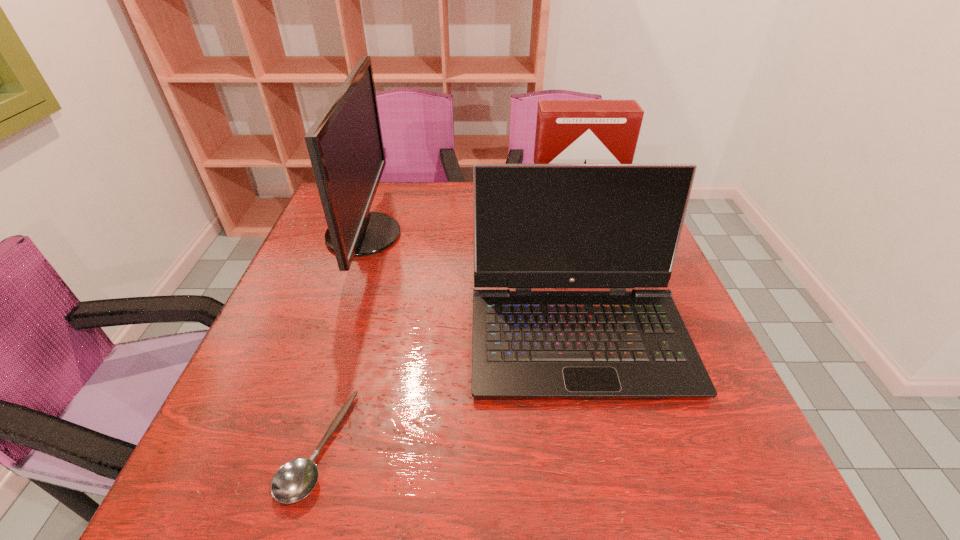
In the image, there is a desktop. In order to click on vacant region at the right edge in this screenshot , I will do `click(659, 422)`.

At what (x,y) coordinates should I click in order to perform the action: click on vacant space at the near left corner of the desktop. Please return your answer as a coordinate pair (x, y). The image size is (960, 540). Looking at the image, I should click on (281, 511).

This screenshot has height=540, width=960. Identify the location of vacant space at the near right corner of the desktop. (715, 503).

I want to click on free spot between the ladle and the cigarette_case, so click(444, 339).

Find the location of a particular element. This screenshot has width=960, height=540. empty space that is in between the cigarette_case and the monitor is located at coordinates (467, 234).

You are a GUI agent. You are given a task and a screenshot of the screen. Output one action in this format:
    pyautogui.click(x=<x>, y=<y>)
    Task: Click on the free space that is in between the cigarette_case and the monitor
    The image size is (960, 540).
    Given the screenshot: What is the action you would take?
    pyautogui.click(x=467, y=234)

Image resolution: width=960 pixels, height=540 pixels. Find the location of `free spot between the monitor and the shortest object`. free spot between the monitor and the shortest object is located at coordinates (341, 341).

Where is `free spot between the monitor and the laptop computer`? The height and width of the screenshot is (540, 960). free spot between the monitor and the laptop computer is located at coordinates (470, 284).

The height and width of the screenshot is (540, 960). I want to click on free point between the shortest object and the monitor, so click(341, 341).

You are a GUI agent. You are given a task and a screenshot of the screen. Output one action in this format:
    pyautogui.click(x=<x>, y=<y>)
    Task: Click on the vacant region between the ladle and the laptop computer
    
    Given the screenshot: What is the action you would take?
    pyautogui.click(x=447, y=389)